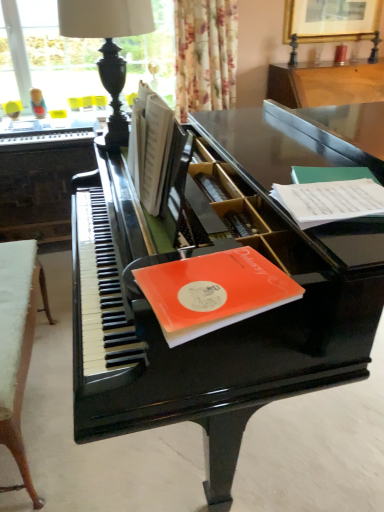
Question: Is glossy black piano at center wider or thinner than white paper at right, acting as the 1th paperback book starting from the top?

Choices:
 (A) wide
 (B) thin

Answer: (A)

Question: From the image's perspective, is glossy black piano at center positioned above or below white paper at right, acting as the 1th paperback book starting from the top?

Choices:
 (A) below
 (B) above

Answer: (A)

Question: Which is nearer to the floral fabric curtain at upper center?

Choices:
 (A) black polished wood table lamp at upper left
 (B) white fabric stool at lower left, which is the second table from back to front
 (C) white paper at right, the second paperback book positioned from the left
 (D) black polished piano at left, which is the 1th table from top to bottom
 (E) white paper book at center

Answer: (D)

Question: Which object is positioned farthest from the white paper book at center?

Choices:
 (A) glossy black piano at center
 (B) white fabric stool at lower left, the first table positioned from the bottom
 (C) floral fabric curtain at upper center
 (D) orange matte paper at piano top, which is the first paperback book from left to right
 (E) black polished piano at left, the second table from the bottom

Answer: (C)